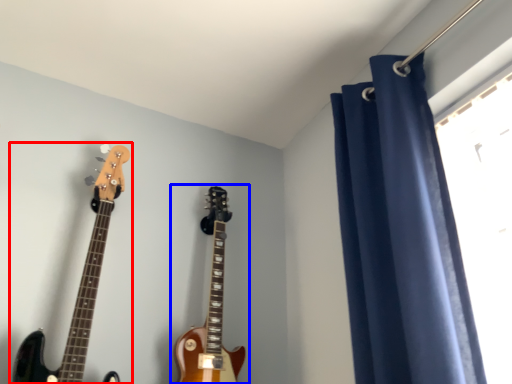
Question: Which of the following is the closest to the observer, guitar (highlighted by a red box) or guitar (highlighted by a blue box)?

Choices:
 (A) guitar
 (B) guitar

Answer: (A)